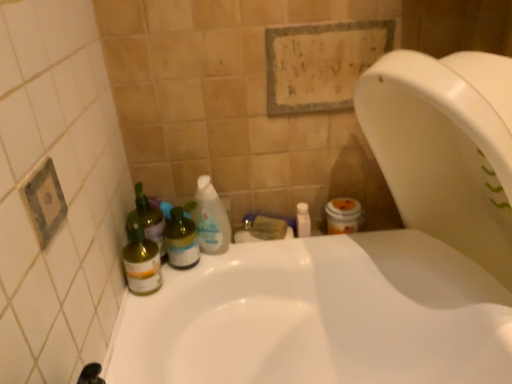
Question: From a real-world perspective, is translucent green bottle at left, the first bottle positioned from the left, under green glass bottle at left, arranged as the second bottle when viewed from the left?

Choices:
 (A) no
 (B) yes

Answer: (B)

Question: Is translucent green bottle at left, positioned as the 2th bottle in right-to-left order, far away from green glass bottle at left, positioned as the first bottle in right-to-left order?

Choices:
 (A) no
 (B) yes

Answer: (A)

Question: Is translucent green bottle at left, positioned as the 2th bottle in right-to-left order, aimed at green glass bottle at left, positioned as the first bottle in right-to-left order?

Choices:
 (A) yes
 (B) no

Answer: (B)

Question: Can you confirm if translucent green bottle at left, the first bottle positioned from the left, is thinner than green glass bottle at left, arranged as the second bottle when viewed from the left?

Choices:
 (A) yes
 (B) no

Answer: (B)

Question: Can you confirm if translucent green bottle at left, the first bottle positioned from the left, is wider than green glass bottle at left, arranged as the second bottle when viewed from the left?

Choices:
 (A) no
 (B) yes

Answer: (A)

Question: Based on their positions, is translucent plastic bottle at left, which is the first cleaning product from left to right, located to the left or right of white glossy bottle at upper center?

Choices:
 (A) right
 (B) left

Answer: (B)

Question: Considering the positions of point (145, 195) and point (297, 210), is point (145, 195) closer or farther from the camera than point (297, 210)?

Choices:
 (A) farther
 (B) closer

Answer: (B)

Question: Considering the positions of translucent plastic bottle at left, which is the first cleaning product from left to right, and white glossy bottle at upper center in the image, is translucent plastic bottle at left, which is the first cleaning product from left to right, bigger or smaller than white glossy bottle at upper center?

Choices:
 (A) small
 (B) big

Answer: (B)

Question: From their relative heights in the image, would you say translucent plastic bottle at left, which is the first cleaning product from left to right, is taller or shorter than white glossy bottle at upper center?

Choices:
 (A) short
 (B) tall

Answer: (B)

Question: From the image's perspective, is translucent green bottle at left, the first bottle positioned from the left, located above or below translucent plastic bottle at center, placed as the 2th cleaning product when sorted from left to right?

Choices:
 (A) above
 (B) below

Answer: (B)

Question: Considering their positions, is translucent green bottle at left, positioned as the 2th bottle in right-to-left order, located in front of or behind translucent plastic bottle at center, which is the first cleaning product in right-to-left order?

Choices:
 (A) front
 (B) behind

Answer: (A)

Question: Choose the correct answer: Is translucent green bottle at left, the first bottle positioned from the left, inside translucent plastic bottle at center, placed as the 2th cleaning product when sorted from left to right, or outside it?

Choices:
 (A) inside
 (B) outside

Answer: (B)

Question: Is translucent green bottle at left, positioned as the 2th bottle in right-to-left order, taller or shorter than translucent plastic bottle at center, placed as the 2th cleaning product when sorted from left to right?

Choices:
 (A) tall
 (B) short

Answer: (B)

Question: Does point (301, 215) appear closer or farther from the camera than point (143, 221)?

Choices:
 (A) farther
 (B) closer

Answer: (A)

Question: Based on their positions, is white glossy bottle at upper center located to the left or right of translucent plastic bottle at left, which is the first cleaning product from left to right?

Choices:
 (A) left
 (B) right

Answer: (B)